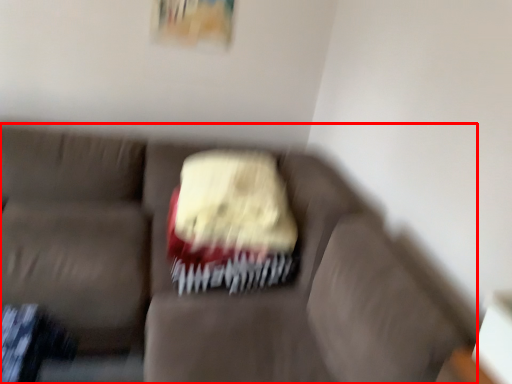
Question: From the image's perspective, what is the correct spatial relationship of studio couch (annotated by the red box) in relation to cake?

Choices:
 (A) above
 (B) below

Answer: (B)